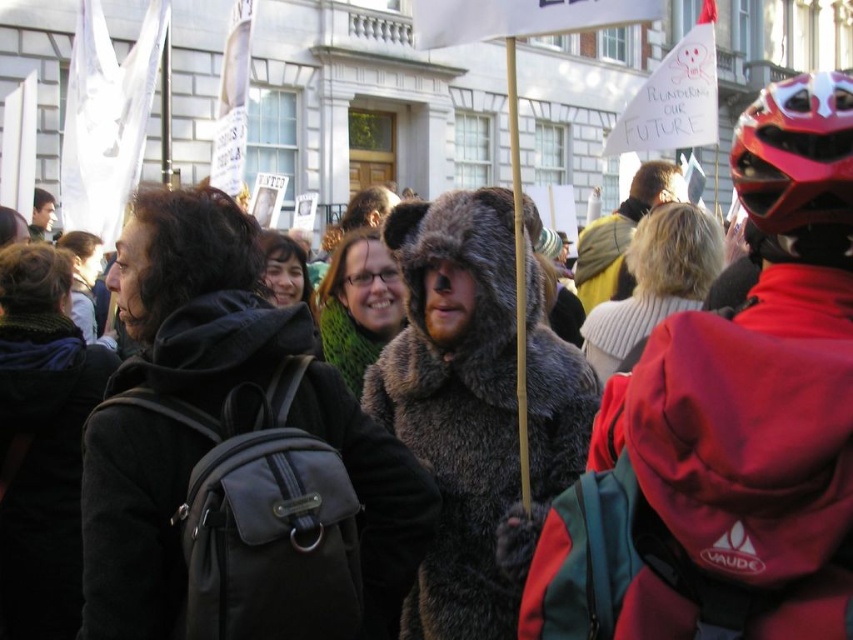
Looking at this image, you are a photographer trying to capture a clear shot of both the dark gray hoodie at center and the green fuzzy scarf at center. Considering their sizes, which object should you focus on first to ensure it fits in the frame?

The dark gray hoodie at center is larger than the green fuzzy scarf at center, so you should focus on capturing the dark gray hoodie at center first to ensure it fits within the frame.

You are a photographer standing at the scene. You want to capture a clear photo of the knitted white sweater at center. Considering the distance between you and the sweater, is it possible to take a clear photo without using a zoom lens?

The knitted white sweater at center and viewer are 39.65 meters apart from each other. Without a zoom lens, capturing a clear photo at this distance would be challenging due to the significant distance involved.